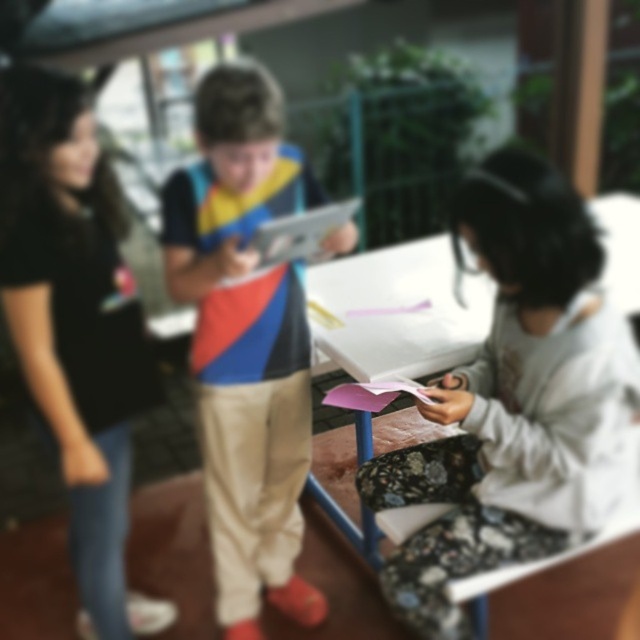
Does matte plastic tablet at center appear over black matte shirt at left?

Indeed, matte plastic tablet at center is positioned over black matte shirt at left.

Does point (269, 344) come farther from viewer compared to point (8, 269)?

Yes, it is.

Is point (227, 412) farther from camera compared to point (132, 285)?

Yes, point (227, 412) is behind point (132, 285).

Image resolution: width=640 pixels, height=640 pixels. What are the coordinates of `matte plastic tablet at center` in the screenshot? It's located at pos(244,340).

Who is positioned more to the right, fluffy white hoodie at lower right or black matte shirt at left?

fluffy white hoodie at lower right is more to the right.

Measure the distance between point (x=579, y=509) and camera.

Point (x=579, y=509) and camera are 1.52 meters apart.

Does point (532, 532) come behind point (72, 497)?

No, (532, 532) is closer to viewer.

I want to click on fluffy white hoodie at lower right, so click(x=513, y=401).

Does fluffy white hoodie at lower right appear on the left side of matte plastic tablet at center?

In fact, fluffy white hoodie at lower right is to the right of matte plastic tablet at center.

Who is more distant from viewer, (525, 320) or (246, 312)?

Positioned behind is point (246, 312).

Locate an element on the screen. The width and height of the screenshot is (640, 640). fluffy white hoodie at lower right is located at coordinates (513, 401).